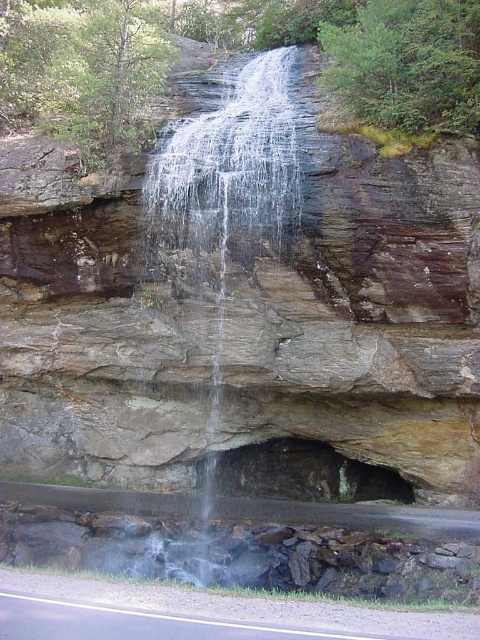
You are a hiker standing at the base of the waterfall. You want to cross the stream to reach the other side. The clear water at center is flowing towards the pool. Which direction should you walk relative to the brown rough rock face at center to avoid the flowing water?

You should walk to the left of the brown rough rock face at center because the clear water at center flows towards the pool, and the rock face is positioned to the right of the water. Moving left would take you away from the flowing stream towards drier ground.

You are a hiker standing at the base of the waterfall. You notice the brown rough rock face at center and the clear water at center. Which object is located lower in the scene?

The brown rough rock face at center is located lower than the clear water at center in the scene.

You are a hiker standing at the base of the waterfall. You notice the brown rough rock face at center and the clear water at center. Which object is closer to you?

The brown rough rock face at center is closer to you because the clear water at center is behind it.